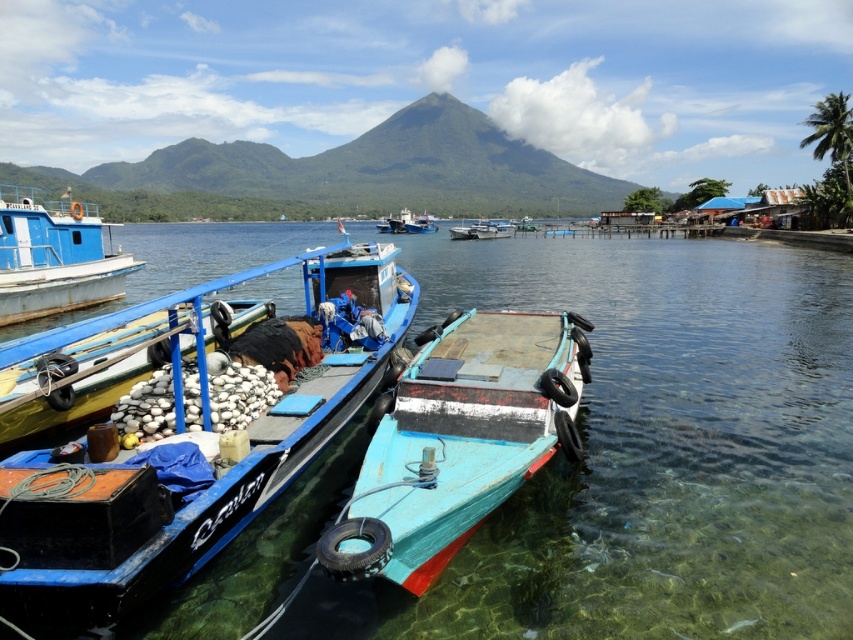
Question: Among these objects, which one is nearest to the camera?

Choices:
 (A) blue painted wooden boat at left
 (B) blue painted wood boat at center
 (C) blue painted wooden boat at center

Answer: (B)

Question: Which point is closer to the camera taking this photo?

Choices:
 (A) (399, 520)
 (B) (109, 298)
 (C) (424, 218)
 (D) (663, 608)

Answer: (A)

Question: Is rusty wooden boat at center smaller than blue painted wooden boat at center?

Choices:
 (A) yes
 (B) no

Answer: (A)

Question: Is clear water at center closer to the viewer compared to blue painted wood boat at center?

Choices:
 (A) yes
 (B) no

Answer: (B)

Question: Observing the image, what is the correct spatial positioning of clear water at center in reference to rusty wooden boat at center?

Choices:
 (A) left
 (B) right

Answer: (B)

Question: Which point is farther to the camera?

Choices:
 (A) blue painted wooden boat at center
 (B) rusty wooden boat at center

Answer: (A)